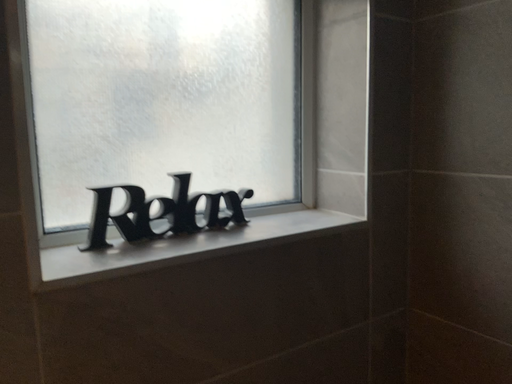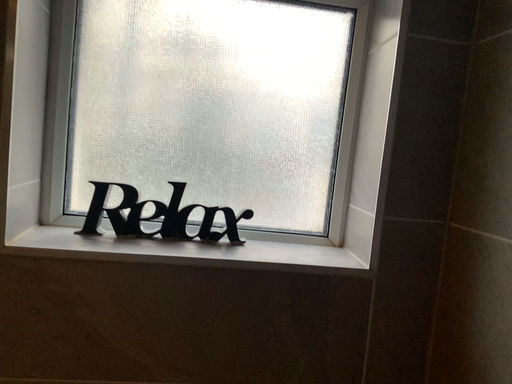
Question: Which way did the camera rotate in the video?

Choices:
 (A) rotated upward
 (B) rotated downward

Answer: (A)